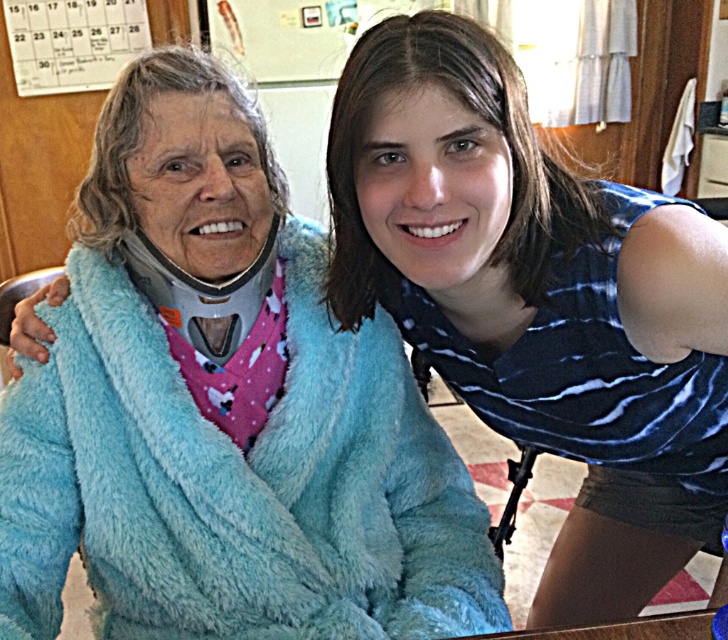
Question: Which of the following is the farthest from the observer?

Choices:
 (A) blue fuzzy bathrobe at left
 (B) blue fuzzy bathrobe at right

Answer: (A)

Question: Which point is farther to the camera?

Choices:
 (A) (221, 548)
 (B) (574, 419)

Answer: (B)

Question: Is blue fuzzy bathrobe at left closer to the viewer compared to blue fuzzy bathrobe at right?

Choices:
 (A) no
 (B) yes

Answer: (A)

Question: Is blue fuzzy bathrobe at left thinner than blue fuzzy bathrobe at right?

Choices:
 (A) no
 (B) yes

Answer: (A)

Question: Can you confirm if blue fuzzy bathrobe at left is positioned below blue fuzzy bathrobe at right?

Choices:
 (A) yes
 (B) no

Answer: (A)